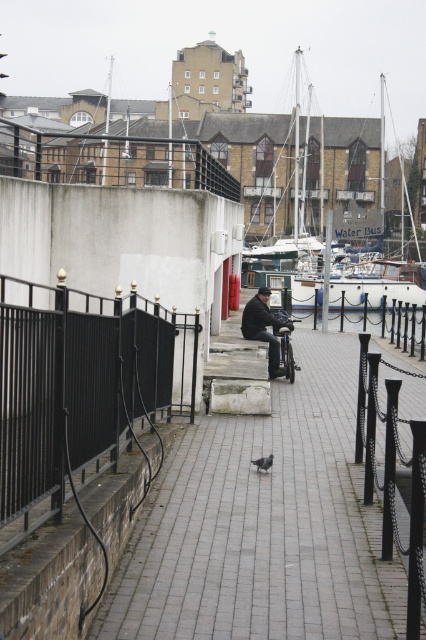
What do you see at coordinates (261, 524) in the screenshot? This screenshot has width=426, height=640. I see `gray brick pavement at center` at bounding box center [261, 524].

Is gray brick pavement at center positioned in front of white wooden boat at center?

Result: Yes, it is in front of white wooden boat at center.

Which is in front, point (359, 483) or point (359, 138)?

Point (359, 483) is more forward.

Find the location of a particular element. gray brick pavement at center is located at coordinates (261, 524).

Does dark gray fabric jacket at center come behind gray matte pigeon at center?

Yes, dark gray fabric jacket at center is behind gray matte pigeon at center.

Who is positioned more to the right, dark gray fabric jacket at center or gray matte pigeon at center?

dark gray fabric jacket at center is more to the right.

Which is behind, point (250, 310) or point (261, 460)?

The point (250, 310) is more distant.

This screenshot has width=426, height=640. I want to click on dark gray fabric jacket at center, so click(264, 326).

What do you see at coordinates (261, 524) in the screenshot?
I see `gray brick pavement at center` at bounding box center [261, 524].

Between point (140, 605) and point (249, 304), which one is positioned in front?

Positioned in front is point (140, 605).

The image size is (426, 640). I want to click on gray brick pavement at center, so click(261, 524).